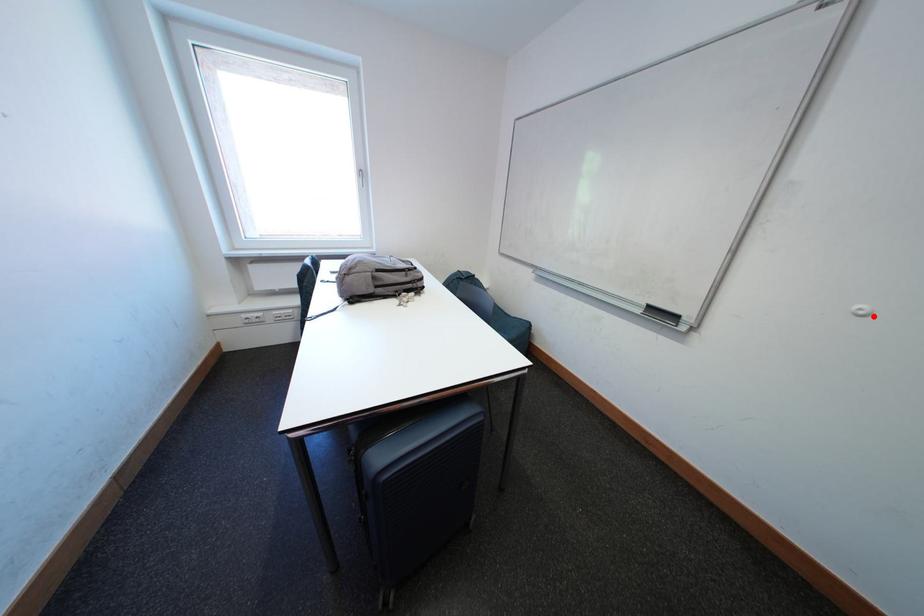
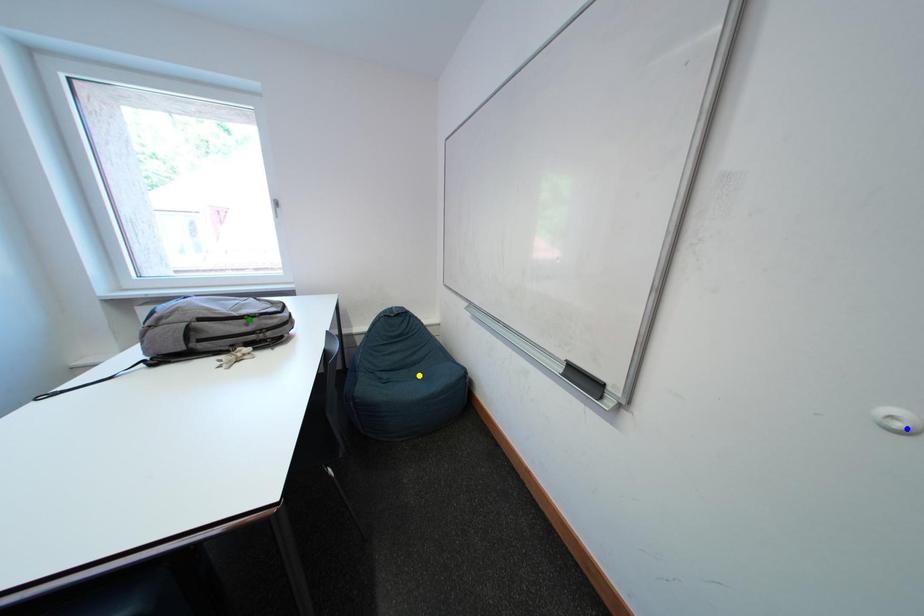
Question: I am providing you with two images of the same scene from different viewpoints. A red point is marked on the first image. You are given multiple points on the second image. Which point in image 2 is actually the same real-world point as the red point in image 1?

Choices:
 (A) blue point
 (B) green point
 (C) yellow point

Answer: (A)